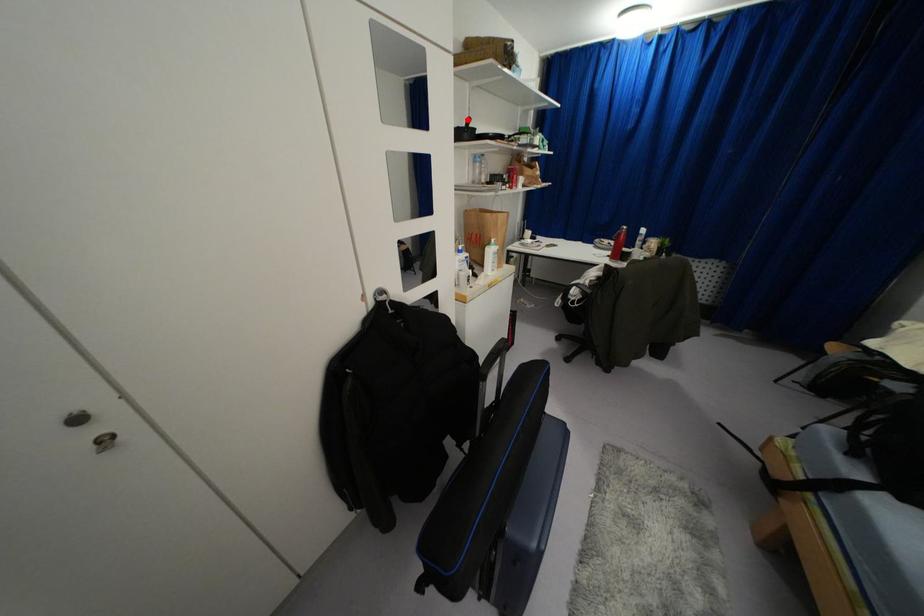
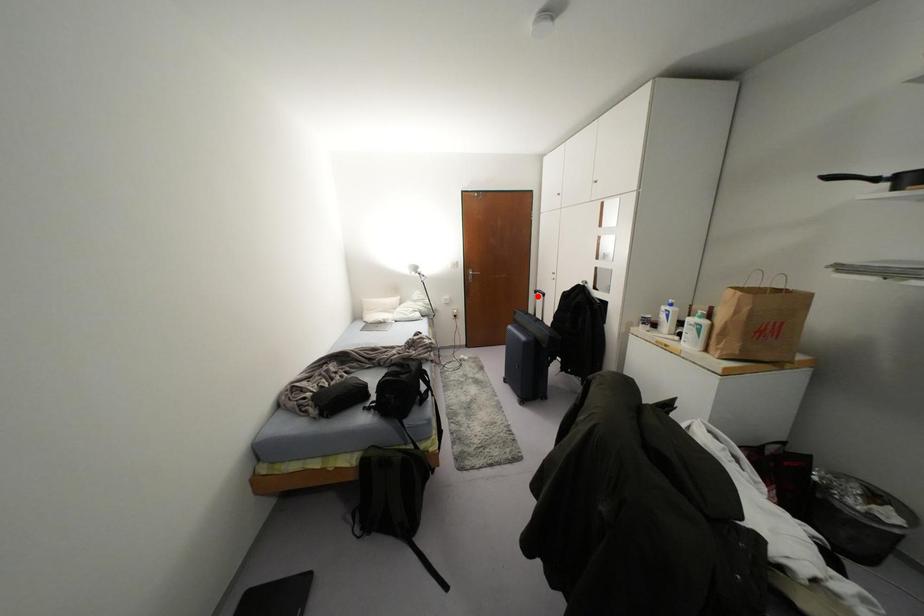
I am providing you with two images of the same scene from different viewpoints. A red point is marked on the first image and another point is marked on the second image. Does the point marked in image1 correspond to the same location as the one in image2?

No